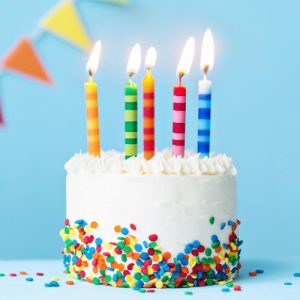
Where is `flames on lit candles on a cake`? flames on lit candles on a cake is located at coordinates (93, 64), (132, 62), (151, 59), (184, 60), (205, 56).